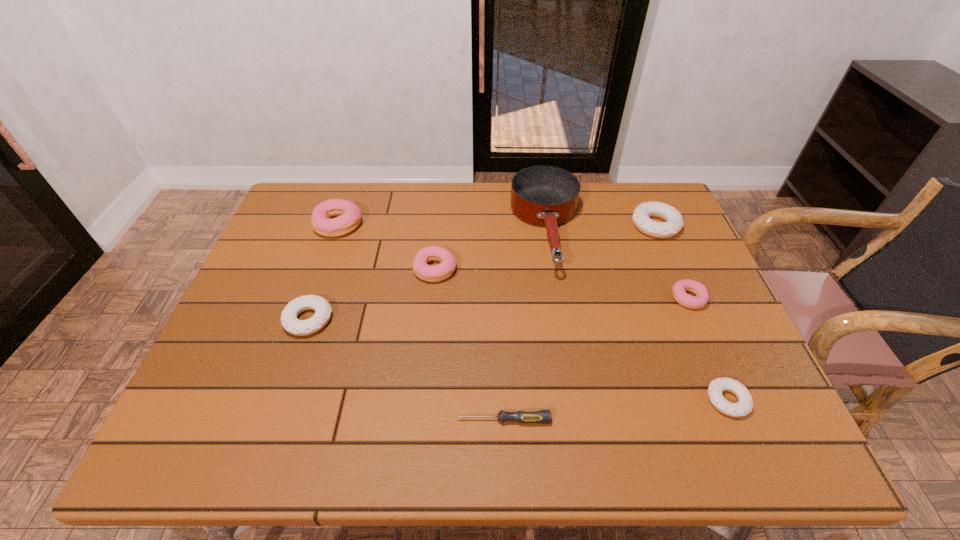
Identify the location of the tallest object. The height and width of the screenshot is (540, 960). (548, 196).

This screenshot has width=960, height=540. In order to click on brown pan in this screenshot , I will do `click(548, 196)`.

Identify the location of the biggest pink doughnut. (349, 215).

Identify the location of the seventh shortest object. The height and width of the screenshot is (540, 960). (349, 215).

The height and width of the screenshot is (540, 960). Identify the location of the biggest white doughnut. (674, 223).

Where is `the second biggest pink doughnut`? the second biggest pink doughnut is located at coordinates (439, 272).

Find the location of `the second pink doughnut from left to right`. the second pink doughnut from left to right is located at coordinates (439, 272).

The image size is (960, 540). Find the location of `the leftmost white doughnut`. the leftmost white doughnut is located at coordinates (290, 322).

Where is `the second farthest white doughnut`? Image resolution: width=960 pixels, height=540 pixels. the second farthest white doughnut is located at coordinates (290, 322).

Locate an element on the screen. The width and height of the screenshot is (960, 540). the rightmost pink doughnut is located at coordinates (680, 287).